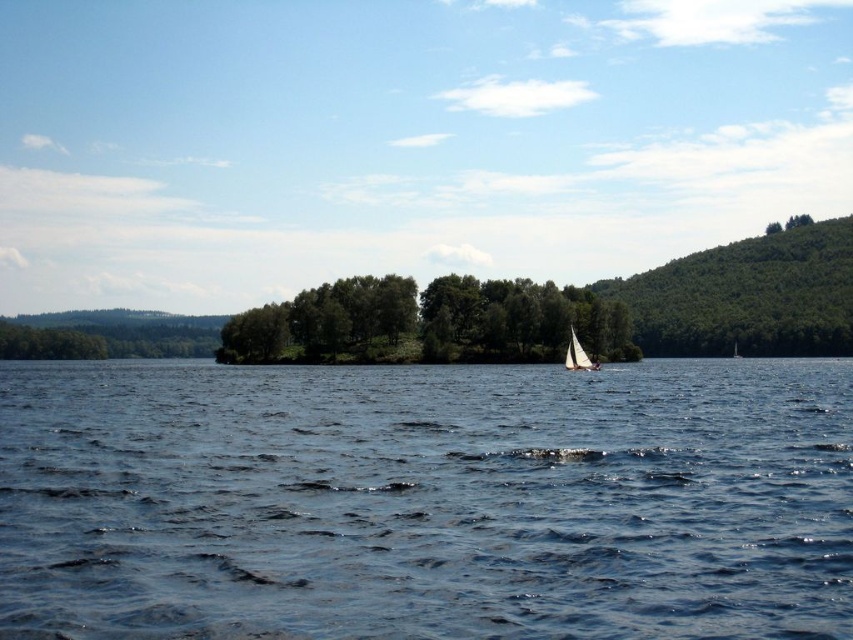
You are a photographer planning to capture the blue water at center and the white sailboat at center in a single shot. Based on their positions, can you determine which object will appear closer to the camera in the photo?

The blue water at center is in front of the white sailboat at center, so it will appear closer to the camera in the photo.

Consider the image. You are standing at the center of the image and want to locate the green leafy trees at center. What are their coordinates?

The green leafy trees at center are located at coordinates point [428,323].